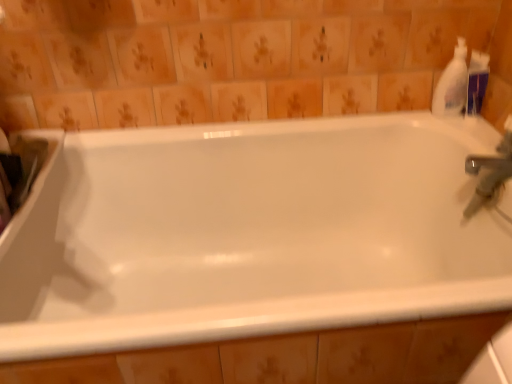
The height and width of the screenshot is (384, 512). Find the location of `free spot in front of white plastic bottle at upper right`. free spot in front of white plastic bottle at upper right is located at coordinates (470, 137).